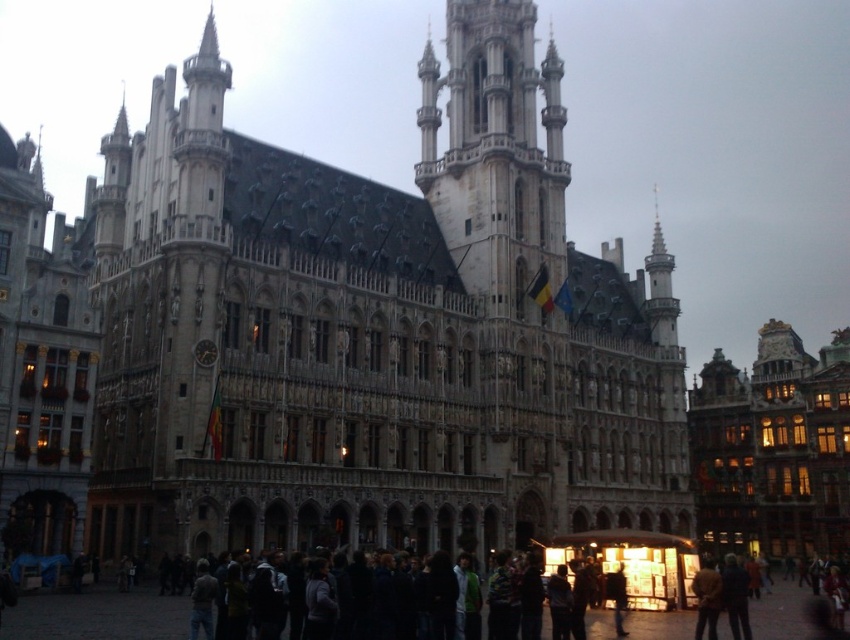
Question: Is stone building at center further to camera compared to stone tower at center?

Choices:
 (A) yes
 (B) no

Answer: (B)

Question: Which of the following is the farthest from the observer?

Choices:
 (A) (295, 432)
 (B) (486, 209)

Answer: (B)

Question: Which object is closer to the camera taking this photo?

Choices:
 (A) stone building at center
 (B) stone tower at center

Answer: (A)

Question: Does stone building at center have a lesser width compared to stone tower at center?

Choices:
 (A) no
 (B) yes

Answer: (A)

Question: Can you confirm if stone building at center is positioned to the left of stone tower at center?

Choices:
 (A) yes
 (B) no

Answer: (A)